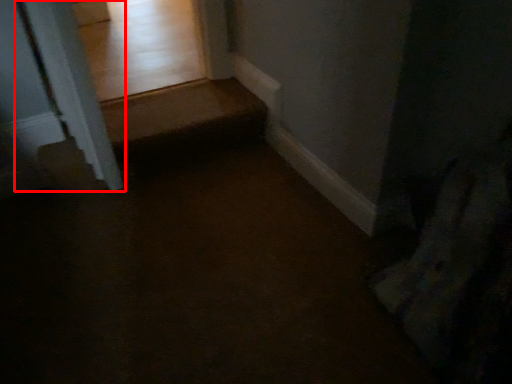
Question: Observing the image, what is the correct spatial positioning of pillar (annotated by the red box) in reference to path?

Choices:
 (A) right
 (B) left

Answer: (B)